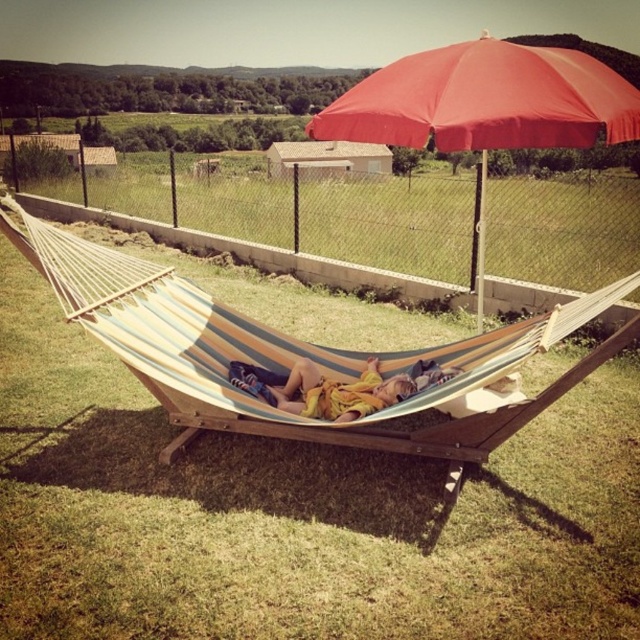
You are planning to set up a picnic in this area and have two items with you, a red fabric umbrella at upper center and a yellow fabric at center. Which item would provide more shade coverage for your picnic setup?

The red fabric umbrella at upper center is larger in size than the yellow fabric at center, so it would provide more shade coverage for your picnic setup.

You are planning to set up a picnic area in this scene. You have a picnic blanket that can fit under the striped fabric hammock at center or the red fabric umbrella at upper center. Which object provides more space for your blanket?

The red fabric umbrella at upper center provides more space because it is larger than the striped fabric hammock at center.